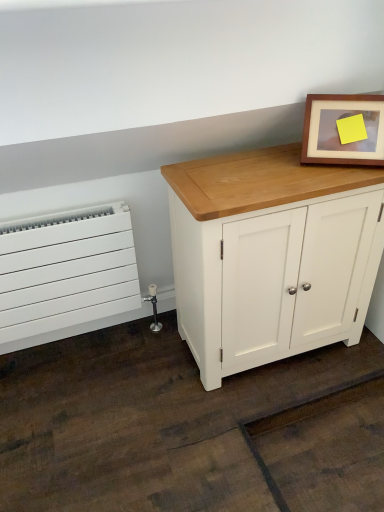
Question: Should I look upward or downward to see wooden picture frame at upper right?

Choices:
 (A) up
 (B) down

Answer: (A)

Question: Is white painted wood cabinet at center bigger than white matte radiator at left?

Choices:
 (A) no
 (B) yes

Answer: (B)

Question: Considering the relative positions of white painted wood cabinet at center and white matte radiator at left in the image provided, is white painted wood cabinet at center to the left of white matte radiator at left from the viewer's perspective?

Choices:
 (A) no
 (B) yes

Answer: (A)

Question: Is the surface of white painted wood cabinet at center in direct contact with white matte radiator at left?

Choices:
 (A) no
 (B) yes

Answer: (A)

Question: Does white painted wood cabinet at center have a smaller size compared to white matte radiator at left?

Choices:
 (A) yes
 (B) no

Answer: (B)

Question: Is white painted wood cabinet at center aimed at white matte radiator at left?

Choices:
 (A) yes
 (B) no

Answer: (B)

Question: From a real-world perspective, is white painted wood cabinet at center below white matte radiator at left?

Choices:
 (A) no
 (B) yes

Answer: (A)

Question: Is white painted wood cabinet at center turned away from wooden picture frame at upper right?

Choices:
 (A) yes
 (B) no

Answer: (B)

Question: Does white painted wood cabinet at center appear on the left side of wooden picture frame at upper right?

Choices:
 (A) no
 (B) yes

Answer: (B)

Question: Can you confirm if white painted wood cabinet at center is smaller than wooden picture frame at upper right?

Choices:
 (A) yes
 (B) no

Answer: (B)

Question: Can you confirm if white painted wood cabinet at center is thinner than wooden picture frame at upper right?

Choices:
 (A) no
 (B) yes

Answer: (A)

Question: Is the depth of white painted wood cabinet at center greater than that of wooden picture frame at upper right?

Choices:
 (A) no
 (B) yes

Answer: (A)

Question: Could you tell me if white painted wood cabinet at center is facing wooden picture frame at upper right?

Choices:
 (A) yes
 (B) no

Answer: (B)

Question: Can you confirm if white matte radiator at left is smaller than wooden picture frame at upper right?

Choices:
 (A) yes
 (B) no

Answer: (B)